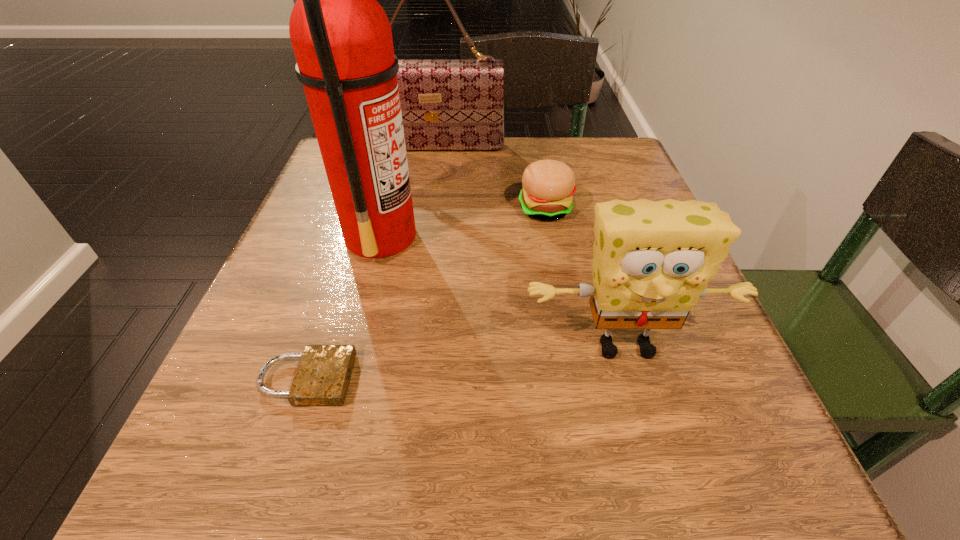
This screenshot has width=960, height=540. What are the coordinates of `blank area at the far edge` in the screenshot? It's located at click(x=445, y=194).

In the image, there is a desktop. Where is `free space at the near edge`? This screenshot has width=960, height=540. free space at the near edge is located at coordinates (602, 468).

Locate an element on the screen. blank area at the left edge is located at coordinates (350, 285).

You are a GUI agent. You are given a task and a screenshot of the screen. Output one action in this format:
    pyautogui.click(x=<x>, y=<y>)
    Task: Click on the vacant space at the right edge of the desktop
    The width and height of the screenshot is (960, 540).
    Given the screenshot: What is the action you would take?
    pyautogui.click(x=703, y=398)

Where is `blank area at the near left corner`? The height and width of the screenshot is (540, 960). blank area at the near left corner is located at coordinates coord(260,505).

Where is `vacant space at the far right corner`? This screenshot has height=540, width=960. vacant space at the far right corner is located at coordinates (573, 166).

In the image, there is a desktop. At what (x,y) coordinates should I click in order to perform the action: click on free space at the near right corner. Please return your answer as a coordinate pair (x, y). Looking at the image, I should click on pos(667,476).

The height and width of the screenshot is (540, 960). Find the location of `free point between the hamburger and the padlock`. free point between the hamburger and the padlock is located at coordinates (426, 294).

The image size is (960, 540). Find the location of `vacant space in between the handbag and the fourth tallest object`. vacant space in between the handbag and the fourth tallest object is located at coordinates (491, 178).

At what (x,y) coordinates should I click in order to perform the action: click on vacant point located between the tallest object and the hamburger. Please return your answer as a coordinate pair (x, y). The image size is (960, 540). Looking at the image, I should click on (463, 222).